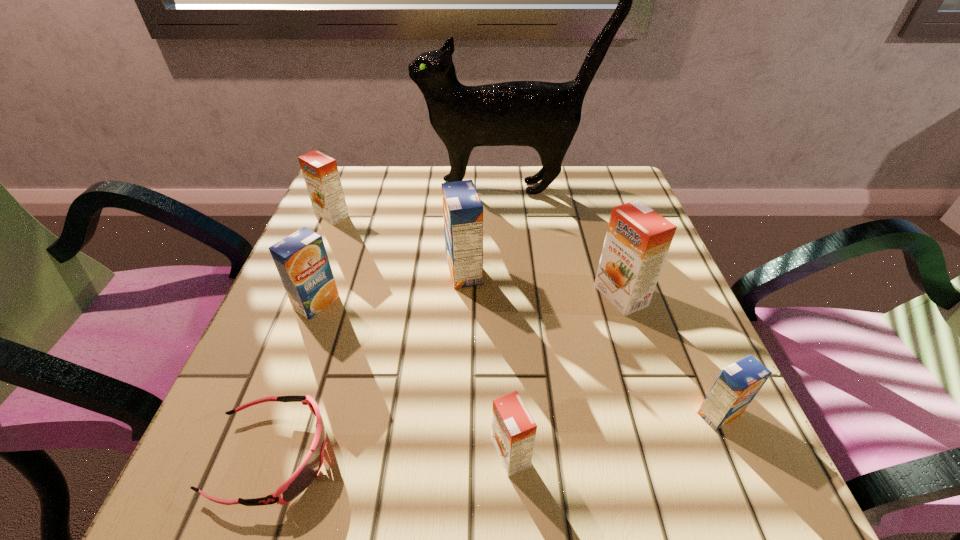
Locate an element on the screen. The image size is (960, 540). black cat is located at coordinates (543, 115).

The image size is (960, 540). Identify the location of the farthest object. (543, 115).

Where is `the second blue orange_juice from left to right`? The width and height of the screenshot is (960, 540). the second blue orange_juice from left to right is located at coordinates (462, 208).

Where is `the biggest blue orange_juice`? This screenshot has width=960, height=540. the biggest blue orange_juice is located at coordinates (462, 208).

Find the location of `the biggest orange orange juice`. the biggest orange orange juice is located at coordinates (637, 241).

Where is `the rightmost orange orange juice`? Image resolution: width=960 pixels, height=540 pixels. the rightmost orange orange juice is located at coordinates (637, 241).

The width and height of the screenshot is (960, 540). What are the coordinates of `the second smallest orange orange juice` in the screenshot? It's located at (320, 172).

I want to click on the leftmost orange orange juice, so click(x=320, y=172).

Locate an element on the screen. the leftmost blue orange_juice is located at coordinates (301, 259).

Find the location of a particular element. the nearest blue orange_juice is located at coordinates (737, 385).